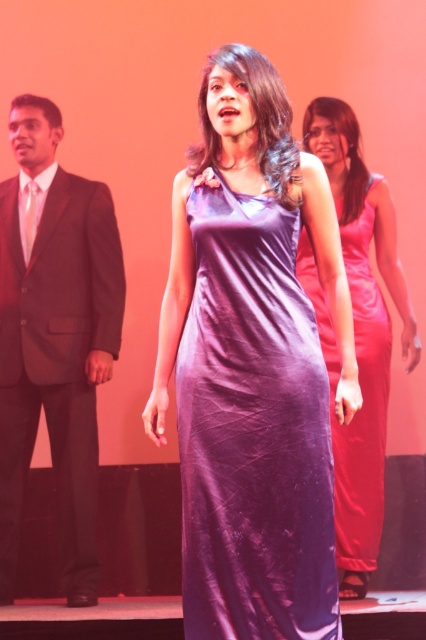
Question: Which of the following is the closest to the observer?

Choices:
 (A) (89, 408)
 (B) (353, 300)
 (C) (255, 538)

Answer: (C)

Question: Is purple velvet dress at center further to camera compared to shiny black suit at left?

Choices:
 (A) no
 (B) yes

Answer: (A)

Question: Which point is closer to the camera?

Choices:
 (A) (94, 476)
 (B) (313, 588)

Answer: (B)

Question: Which object appears farthest from the camera in this image?

Choices:
 (A) shiny black suit at left
 (B) purple velvet dress at center
 (C) purple satin dress at center

Answer: (A)

Question: Can you confirm if purple velvet dress at center is wider than purple satin dress at center?

Choices:
 (A) yes
 (B) no

Answer: (A)

Question: Does purple velvet dress at center have a smaller size compared to purple satin dress at center?

Choices:
 (A) yes
 (B) no

Answer: (A)